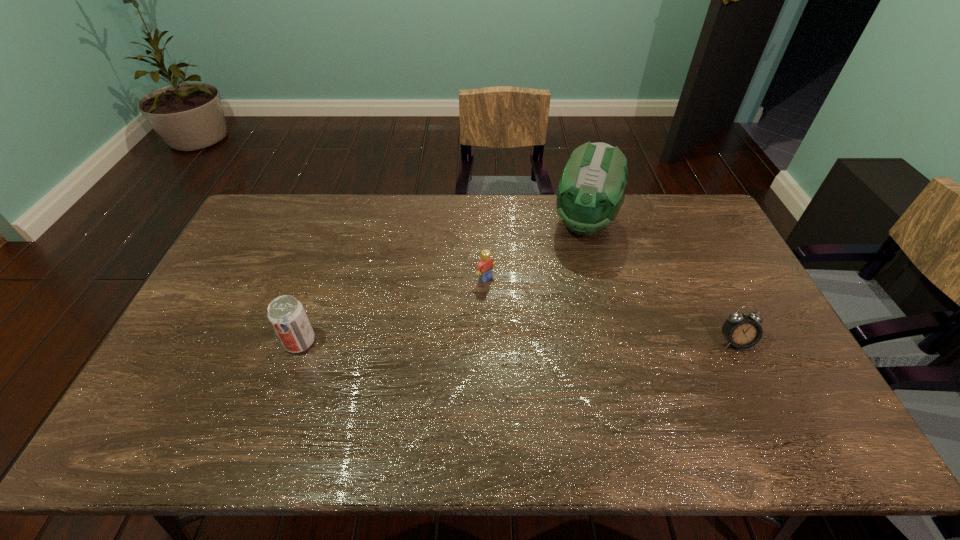
Find the location of a particular element. vacant space located on the front-facing side of the second object from left to right is located at coordinates (564, 342).

At what (x,y) coordinates should I click in order to perform the action: click on vacant space located 0.390m on the front-facing side of the second object from left to right. Please return your answer as a coordinate pair (x, y). Looking at the image, I should click on (590, 363).

Image resolution: width=960 pixels, height=540 pixels. I want to click on free location located on the visor of the football helmet, so click(x=551, y=329).

Find the location of a particular element. vacant region located 0.300m on the visor of the football helmet is located at coordinates tap(557, 312).

Locate an element on the screen. The height and width of the screenshot is (540, 960). vacant space located 0.270m on the visor of the football helmet is located at coordinates (560, 305).

This screenshot has height=540, width=960. In order to click on object present at the far edge in this screenshot , I will do `click(590, 193)`.

You are a GUI agent. You are given a task and a screenshot of the screen. Output one action in this format:
    pyautogui.click(x=<x>, y=<y>)
    Task: Click on the object that is at the right edge
    The image size is (960, 540).
    Given the screenshot: What is the action you would take?
    pyautogui.click(x=741, y=330)

In the image, there is a desktop. At what (x,y) coordinates should I click in order to perform the action: click on free region at the far edge. Please return your answer as a coordinate pair (x, y). The image size is (960, 540). Looking at the image, I should click on (468, 194).

You are a GUI agent. You are given a task and a screenshot of the screen. Output one action in this format:
    pyautogui.click(x=<x>, y=<y>)
    Task: Click on the free spot at the near edge of the desktop
    
    Given the screenshot: What is the action you would take?
    pyautogui.click(x=255, y=394)

The image size is (960, 540). In order to click on vacant space at the left edge of the desktop in this screenshot , I will do `click(222, 347)`.